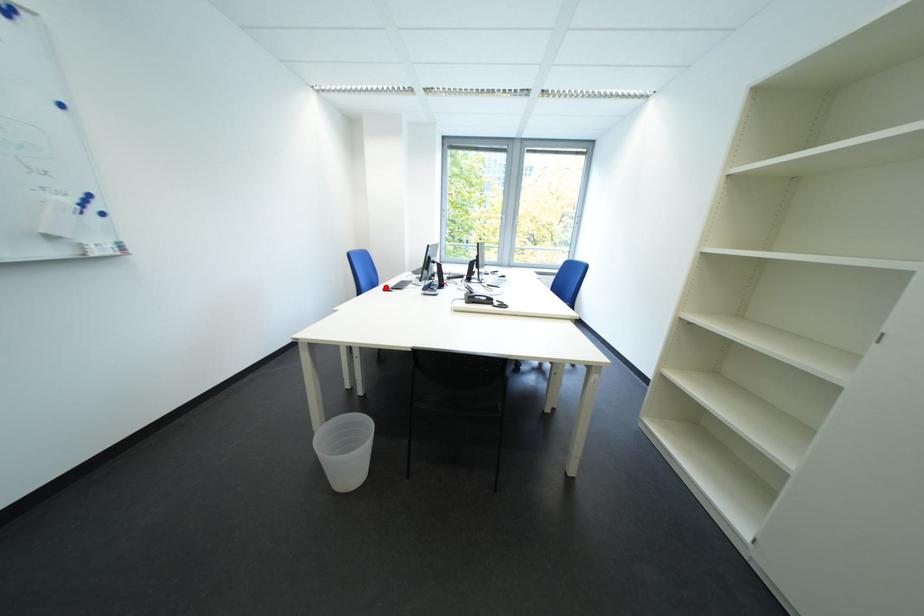
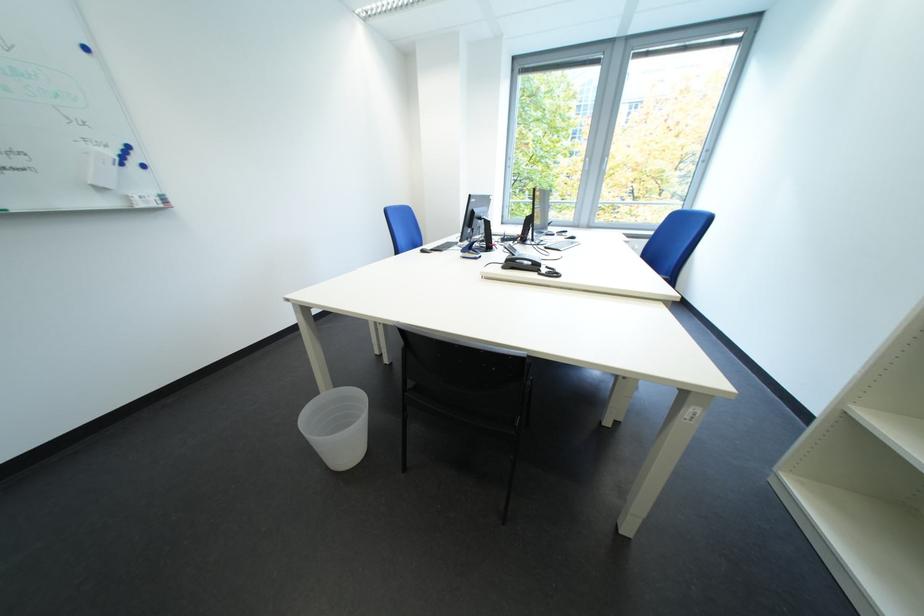
Locate, in the second image, the point that corresponds to the highlighted location in the first image.

(427, 248)